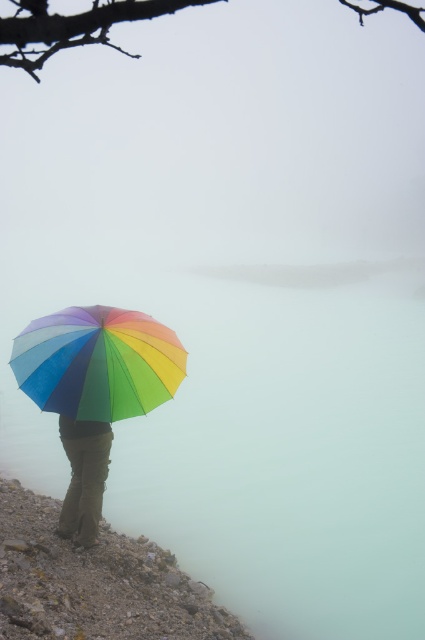
Question: Based on their relative distances, which object is nearer to the translucent misty water at lower center?

Choices:
 (A) rough stone hillside at lower left
 (B) rainbow fabric umbrella at center

Answer: (B)

Question: Among these objects, which one is farthest from the camera?

Choices:
 (A) translucent misty water at lower center
 (B) rough stone hillside at lower left

Answer: (A)

Question: In this image, where is translucent misty water at lower center located relative to rainbow fabric umbrella at center?

Choices:
 (A) right
 (B) left

Answer: (A)

Question: Where is translucent misty water at lower center located in relation to matte green pants at lower left in the image?

Choices:
 (A) left
 (B) right

Answer: (B)

Question: Which is farther from the translucent misty water at lower center?

Choices:
 (A) matte green pants at lower left
 (B) rough stone hillside at lower left

Answer: (A)

Question: Can you confirm if translucent misty water at lower center is wider than rough stone hillside at lower left?

Choices:
 (A) no
 (B) yes

Answer: (B)